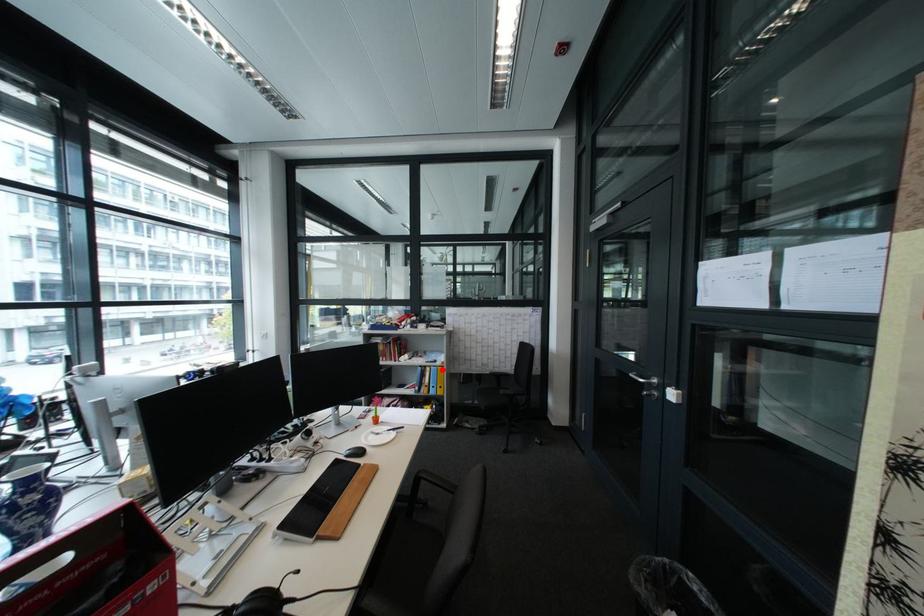
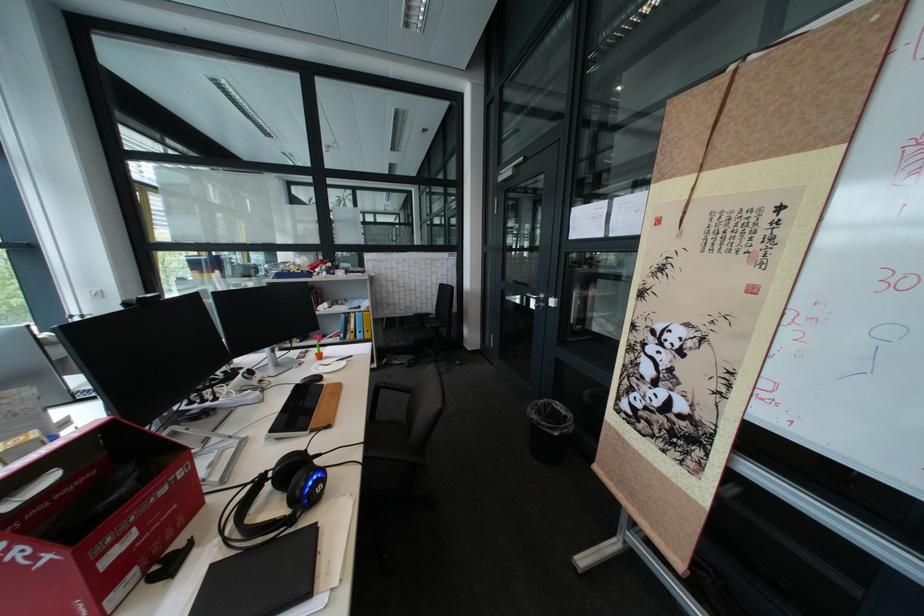
Question: I am providing you with two images of the same scene from different viewpoints. A red point is shown in image1. For the corresponding object point in image2, is it positioned nearer or farther from the camera?

Choices:
 (A) Nearer
 (B) Farther

Answer: (A)